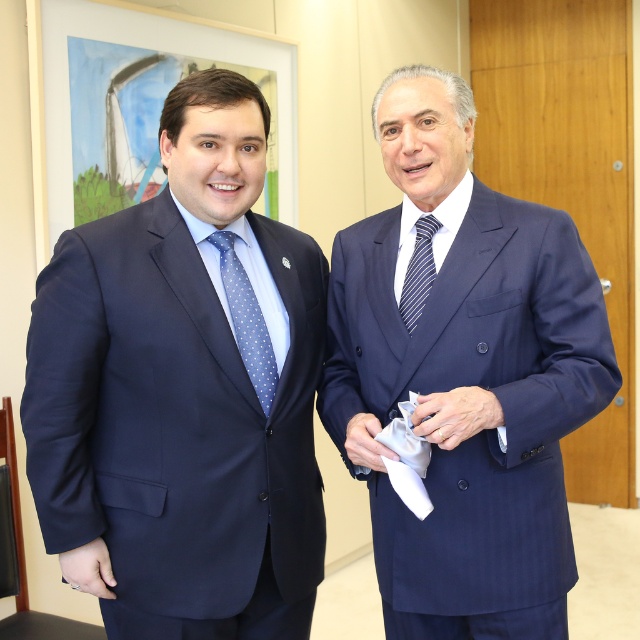
Question: Is satin blue suit at center thinner than blue dotted tie at left?

Choices:
 (A) no
 (B) yes

Answer: (A)

Question: Considering the real-world distances, which object is closest to the blue striped tie at center?

Choices:
 (A) blue dotted tie at left
 (B) satin blue suit at center
 (C) matte blue suit at center

Answer: (B)

Question: Is matte blue suit at center bigger than blue dotted tie at left?

Choices:
 (A) yes
 (B) no

Answer: (A)

Question: Does blue dotted tie at left appear on the left side of blue striped tie at center?

Choices:
 (A) no
 (B) yes

Answer: (B)

Question: Which point is closer to the camera?

Choices:
 (A) (524, 582)
 (B) (212, 406)

Answer: (B)

Question: Which point is closer to the camera taking this photo?

Choices:
 (A) (188, 262)
 (B) (433, 486)
 (C) (403, 280)
 (D) (266, 369)

Answer: (A)